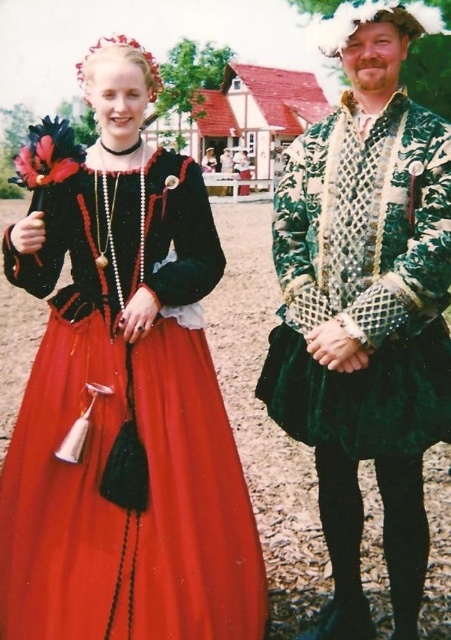
Question: Among these objects, which one is nearest to the camera?

Choices:
 (A) velvet green coat at center
 (B) matte black dress at center

Answer: (A)

Question: Does matte black dress at center appear on the left side of velvet green coat at center?

Choices:
 (A) yes
 (B) no

Answer: (A)

Question: Which point is farther to the camera?

Choices:
 (A) velvet green coat at center
 (B) matte black dress at center

Answer: (B)

Question: Considering the relative positions of matte black dress at center and velvet green coat at center in the image provided, where is matte black dress at center located with respect to velvet green coat at center?

Choices:
 (A) above
 (B) below

Answer: (B)

Question: Is matte black dress at center bigger than velvet green coat at center?

Choices:
 (A) yes
 (B) no

Answer: (B)

Question: Which point is closer to the camera?

Choices:
 (A) velvet green coat at center
 (B) matte black dress at center

Answer: (A)